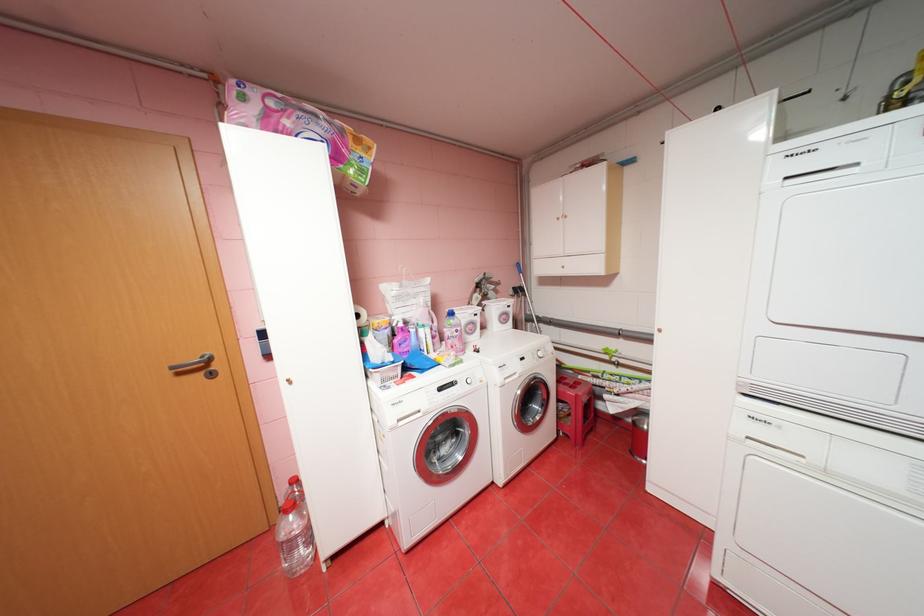
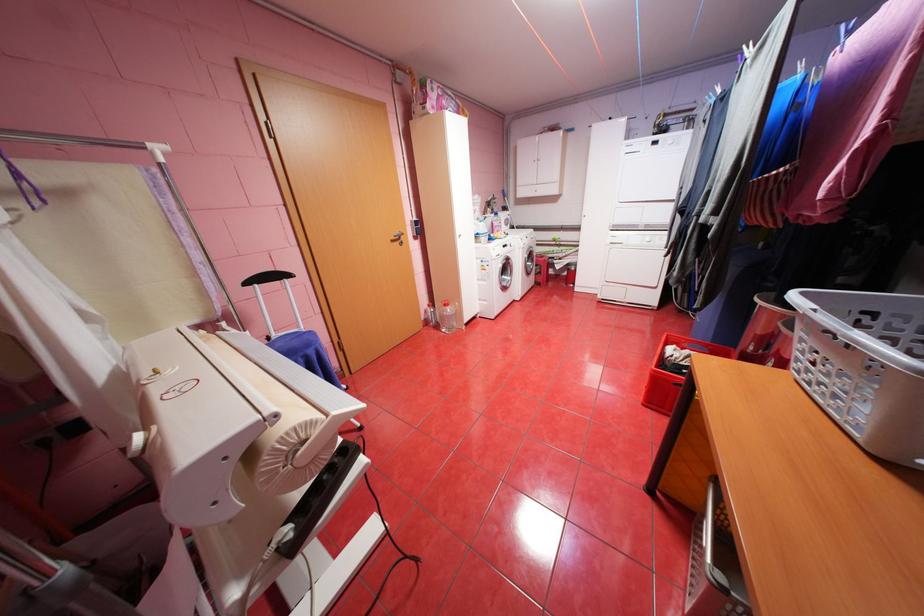
Find the pixel in the second image that matches (188,373) in the first image.

(400, 241)